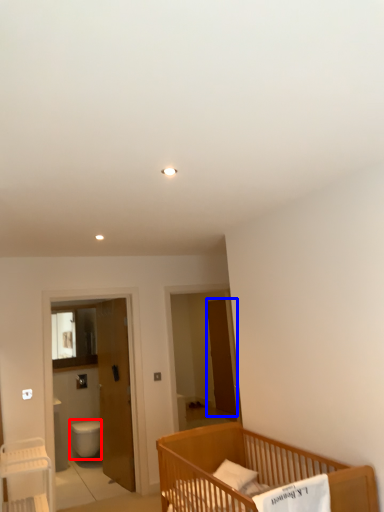
Question: Which of the following is the farthest to the observer, toilet bowl (highlighted by a red box) or screen door (highlighted by a blue box)?

Choices:
 (A) toilet bowl
 (B) screen door

Answer: (B)